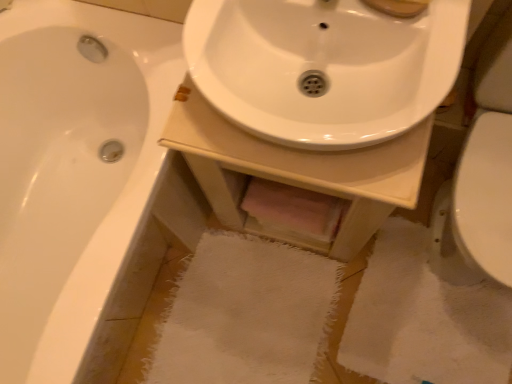
At what (x,y) coordinates should I click in order to perform the action: click on free space above white glossy sink at center (from a real-world perspective). Please return your answer as a coordinate pair (x, y). Image resolution: width=512 pixels, height=384 pixels. Looking at the image, I should click on (304, 119).